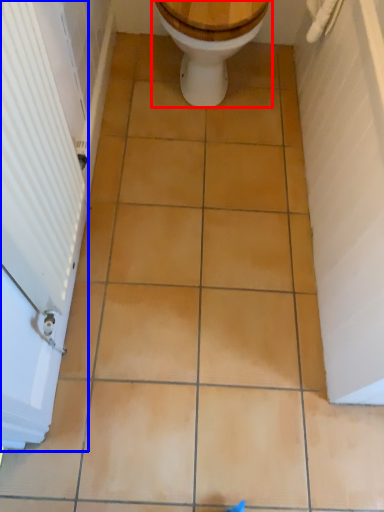
Question: Which of the following is the farthest to the observer, toilet (highlighted by a red box) or screen door (highlighted by a blue box)?

Choices:
 (A) toilet
 (B) screen door

Answer: (A)